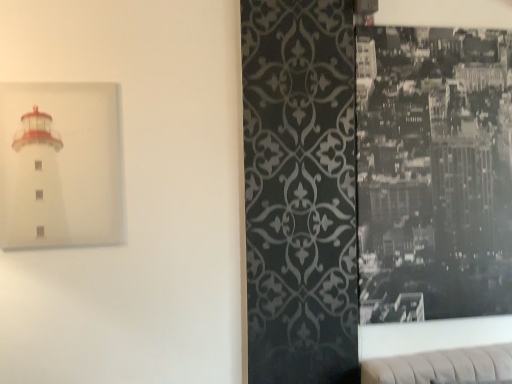
Question: Considering the positions of white matte lighthouse at left, the second picture frame in the right-to-left sequence, and black glossy photo at right, the second picture frame viewed from the front, in the image, is white matte lighthouse at left, the second picture frame in the right-to-left sequence, bigger or smaller than black glossy photo at right, the second picture frame viewed from the front,?

Choices:
 (A) small
 (B) big

Answer: (A)

Question: Is white matte lighthouse at left, which ranks as the 1th picture frame in left-to-right order, wider or thinner than black glossy photo at right, acting as the second picture frame starting from the left?

Choices:
 (A) thin
 (B) wide

Answer: (A)

Question: From a real-world perspective, is white matte lighthouse at left, the second picture frame in the right-to-left sequence, positioned above or below black glossy photo at right, which is counted as the 1th picture frame, starting from the right?

Choices:
 (A) below
 (B) above

Answer: (B)

Question: Does point (396, 97) appear closer or farther from the camera than point (110, 140)?

Choices:
 (A) closer
 (B) farther

Answer: (B)

Question: Relative to white matte lighthouse at left, the second picture frame in the right-to-left sequence, is black glossy photo at right, the second picture frame viewed from the front, in front or behind?

Choices:
 (A) behind
 (B) front

Answer: (A)

Question: From the image's perspective, is black glossy photo at right, which is counted as the 1th picture frame, starting from the right, located above or below white matte lighthouse at left, which ranks as the 1th picture frame in left-to-right order?

Choices:
 (A) below
 (B) above

Answer: (A)

Question: Would you say black glossy photo at right, the second picture frame viewed from the front, is inside or outside white matte lighthouse at left, the 1th picture frame from the front?

Choices:
 (A) inside
 (B) outside

Answer: (B)